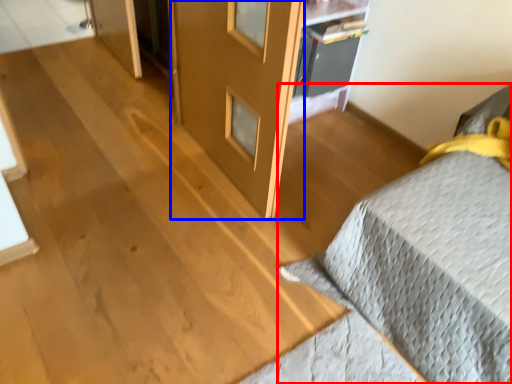
Question: Among these objects, which one is nearest to the camera, furniture (highlighted by a red box) or screen door (highlighted by a blue box)?

Choices:
 (A) furniture
 (B) screen door

Answer: (A)